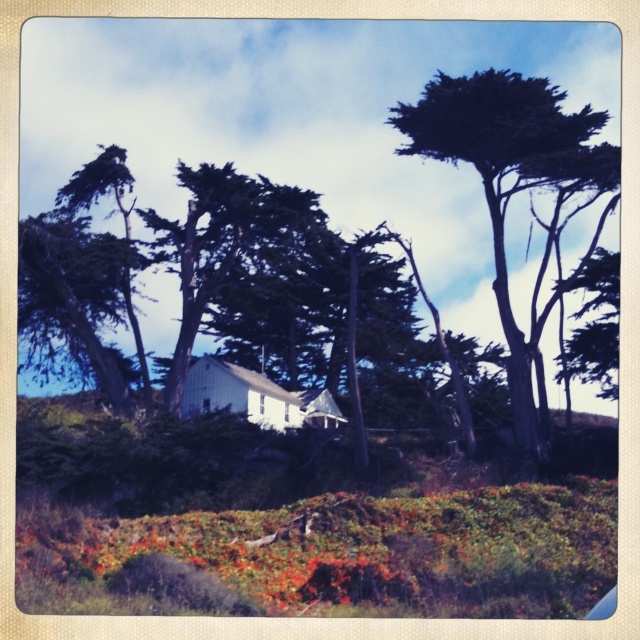
You are a hiker standing at the base of the dark green textured tree at upper right and want to reach the white building in the background. Which direction should you move to avoid the green leafy bush at lower center blocking your view?

You should move away from the green leafy bush at lower center towards the direction of the white building. Since the green leafy bush at lower center is in front of the dark green textured tree at upper right, moving towards the building would allow you to bypass the bush and maintain a clear path.

You are a hiker who wants to take a photo of the dark green textured tree at upper right. You are currently standing next to the green leafy bush at lower center. Which direction should you move to get a better view of the tree?

Since the green leafy bush at lower center is not as tall as the dark green textured tree at upper right, you should move to a higher elevation to ensure the tree is visible above the bush.